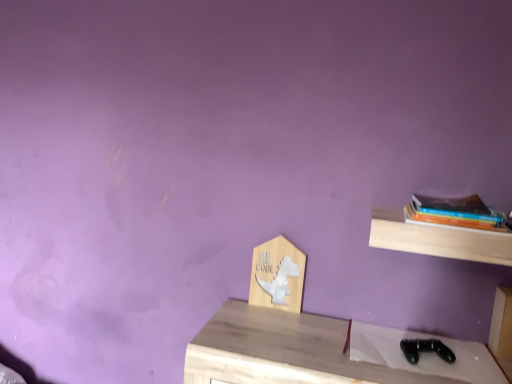
Question: Can you see wooden sign at center, the 1th shelf viewed from the left, touching light wood shelf at upper right, the first shelf when ordered from right to left?

Choices:
 (A) no
 (B) yes

Answer: (A)

Question: Is wooden sign at center, which is the second shelf from front to back, bigger than light wood shelf at upper right, the first shelf when ordered from right to left?

Choices:
 (A) yes
 (B) no

Answer: (B)

Question: Is wooden sign at center, the first shelf when ordered from back to front, outside of light wood shelf at upper right, the 2th shelf from the left?

Choices:
 (A) no
 (B) yes

Answer: (B)

Question: From a real-world perspective, is wooden sign at center, the first shelf when ordered from back to front, beneath light wood shelf at upper right, the first shelf when ordered from right to left?

Choices:
 (A) no
 (B) yes

Answer: (B)

Question: From the image's perspective, is wooden sign at center, which is the second shelf from front to back, below light wood shelf at upper right, the 2th shelf from the left?

Choices:
 (A) no
 (B) yes

Answer: (B)

Question: Does wooden sign at center, the first shelf when ordered from back to front, have a lesser height compared to light wood shelf at upper right, which is the first shelf in front-to-back order?

Choices:
 (A) no
 (B) yes

Answer: (A)

Question: Can you confirm if hardcover books at right is shorter than wooden sign at center, the first shelf when ordered from back to front?

Choices:
 (A) yes
 (B) no

Answer: (A)

Question: Is hardcover books at right far from wooden sign at center, the 2th shelf in the right-to-left sequence?

Choices:
 (A) no
 (B) yes

Answer: (A)

Question: Can you confirm if hardcover books at right is bigger than wooden sign at center, the first shelf when ordered from back to front?

Choices:
 (A) yes
 (B) no

Answer: (A)

Question: Considering the relative sizes of hardcover books at right and wooden sign at center, the 2th shelf in the right-to-left sequence, in the image provided, is hardcover books at right wider than wooden sign at center, the 2th shelf in the right-to-left sequence,?

Choices:
 (A) yes
 (B) no

Answer: (A)

Question: Is hardcover books at right touching wooden sign at center, the first shelf when ordered from back to front?

Choices:
 (A) yes
 (B) no

Answer: (B)

Question: Does hardcover books at right come behind wooden sign at center, the 1th shelf viewed from the left?

Choices:
 (A) yes
 (B) no

Answer: (B)

Question: Considering the relative sizes of light wood shelf at upper right, which is the first shelf in front-to-back order, and wooden sign at center, which is the second shelf from front to back, in the image provided, is light wood shelf at upper right, which is the first shelf in front-to-back order, thinner than wooden sign at center, which is the second shelf from front to back,?

Choices:
 (A) yes
 (B) no

Answer: (B)